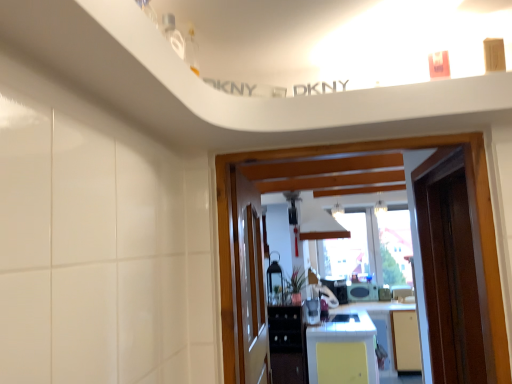
Question: Are yellow matte countertop at center and metallic silver toaster at center, arranged as the 4th appliance when viewed from the back, located far from each other?

Choices:
 (A) no
 (B) yes

Answer: (A)

Question: Does yellow matte countertop at center lie in front of metallic silver toaster at center, arranged as the 4th appliance when viewed from the back?

Choices:
 (A) yes
 (B) no

Answer: (A)

Question: From a real-world perspective, is yellow matte countertop at center under metallic silver toaster at center, arranged as the 4th appliance when viewed from the back?

Choices:
 (A) no
 (B) yes

Answer: (B)

Question: Is yellow matte countertop at center positioned behind metallic silver toaster at center, acting as the 3th appliance starting from the right?

Choices:
 (A) no
 (B) yes

Answer: (A)

Question: Is yellow matte countertop at center smaller than metallic silver toaster at center, which is counted as the 2th appliance, starting from the left?

Choices:
 (A) yes
 (B) no

Answer: (B)

Question: Looking at the image, does metallic silver toaster at center, which ranks as the 2th appliance in back-to-front order, seem bigger or smaller compared to matte black microwave at center, which is the fourth appliance from left to right?

Choices:
 (A) small
 (B) big

Answer: (B)

Question: Looking at their shapes, would you say metallic silver toaster at center, the 3th appliance when ordered from front to back, is wider or thinner than matte black microwave at center, placed as the fourth appliance when sorted from front to back?

Choices:
 (A) thin
 (B) wide

Answer: (B)

Question: Considering the positions of metallic silver toaster at center, acting as the 2th appliance starting from the right, and matte black microwave at center, placed as the fourth appliance when sorted from front to back, in the image, is metallic silver toaster at center, acting as the 2th appliance starting from the right, taller or shorter than matte black microwave at center, placed as the fourth appliance when sorted from front to back,?

Choices:
 (A) tall
 (B) short

Answer: (A)

Question: From a real-world perspective, is metallic silver toaster at center, the 3th appliance when ordered from front to back, above or below matte black microwave at center, which is the fourth appliance from left to right?

Choices:
 (A) above
 (B) below

Answer: (A)

Question: Is point [x=351, y=288] positioned closer to the camera than point [x=346, y=294]?

Choices:
 (A) closer
 (B) farther

Answer: (B)

Question: From a real-world perspective, is matte black microwave at center, the first appliance viewed from the back, positioned above or below metallic silver toaster at center, the 3th appliance when ordered from front to back?

Choices:
 (A) above
 (B) below

Answer: (B)

Question: Considering the positions of matte black microwave at center, which is the fourth appliance from left to right, and metallic silver toaster at center, marked as the 3th appliance in a left-to-right arrangement, in the image, is matte black microwave at center, which is the fourth appliance from left to right, taller or shorter than metallic silver toaster at center, marked as the 3th appliance in a left-to-right arrangement,?

Choices:
 (A) short
 (B) tall

Answer: (A)

Question: Is matte black microwave at center, positioned as the 1th appliance in right-to-left order, inside the boundaries of metallic silver toaster at center, which ranks as the 2th appliance in back-to-front order, or outside?

Choices:
 (A) outside
 (B) inside

Answer: (A)

Question: From the image's perspective, is matte black microwave at center, positioned as the 1th appliance in right-to-left order, above or below metallic lantern at center, the second appliance viewed from the front?

Choices:
 (A) above
 (B) below

Answer: (B)

Question: Considering the positions of matte black microwave at center, which is the fourth appliance from left to right, and metallic lantern at center, the 1th appliance in the left-to-right sequence, in the image, is matte black microwave at center, which is the fourth appliance from left to right, wider or thinner than metallic lantern at center, the 1th appliance in the left-to-right sequence,?

Choices:
 (A) wide
 (B) thin

Answer: (A)